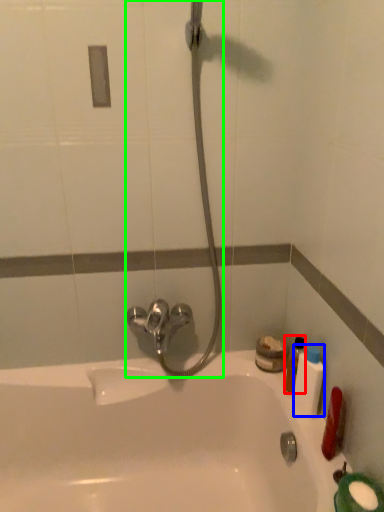
Question: Which object is positioned farthest from mouthwash (highlighted by a red box)? Select from mouthwash (highlighted by a blue box) and shower (highlighted by a green box).

Choices:
 (A) mouthwash
 (B) shower

Answer: (B)